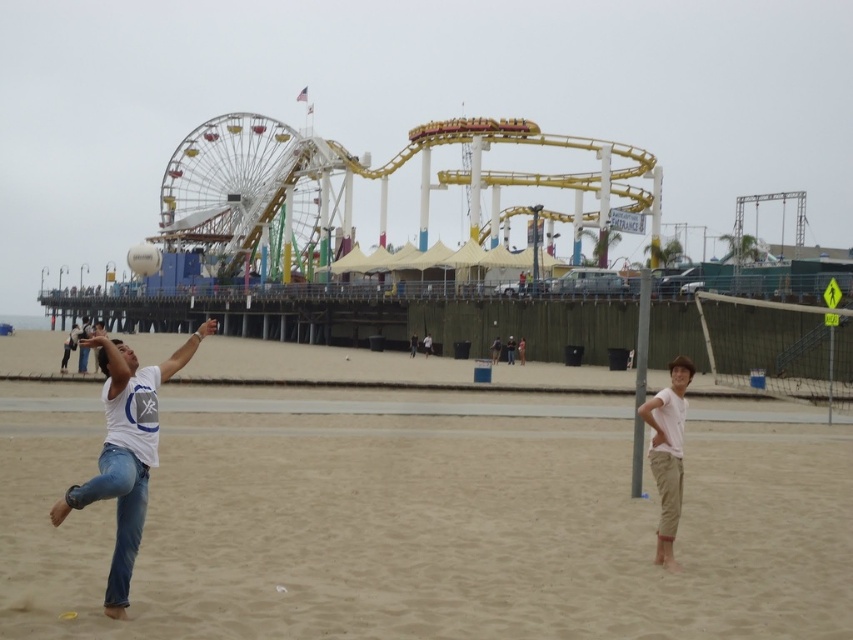
Does point (682, 372) come farther from viewer compared to point (129, 250)?

That is False.

Is point (637, 410) positioned in front of point (141, 244)?

Yes, it is in front of point (141, 244).

At what (x,y) coordinates should I click in order to perform the action: click on white cotton shirt at lower right. Please return your answer as a coordinate pair (x, y). This screenshot has height=640, width=853. Looking at the image, I should click on click(x=666, y=451).

Is white matte t-shirt at center closer to the viewer compared to white matte t-shirt at left?

That is True.

Which is behind, point (102, 490) or point (83, 371)?

The point (83, 371) is more distant.

I want to click on white matte t-shirt at center, so click(x=125, y=451).

Is light brown sand at center thinner than white matte t-shirt at left?

No, light brown sand at center is not thinner than white matte t-shirt at left.

Can you confirm if light brown sand at center is bigger than white matte t-shirt at left?

No.

In order to click on light brown sand at center in this screenshot , I will do pyautogui.click(x=427, y=518).